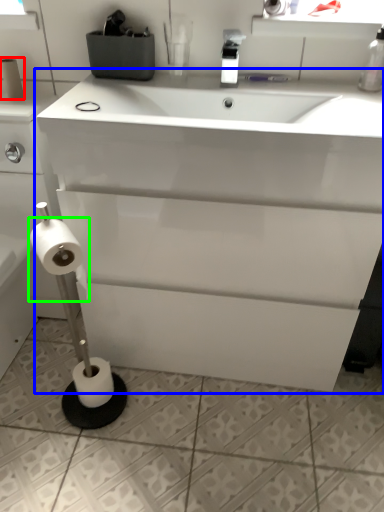
Question: Considering the real-world distances, which object is closest to toilet paper (highlighted by a red box)? bathroom cabinet (highlighted by a blue box) or toilet paper (highlighted by a green box).

Choices:
 (A) bathroom cabinet
 (B) toilet paper

Answer: (B)